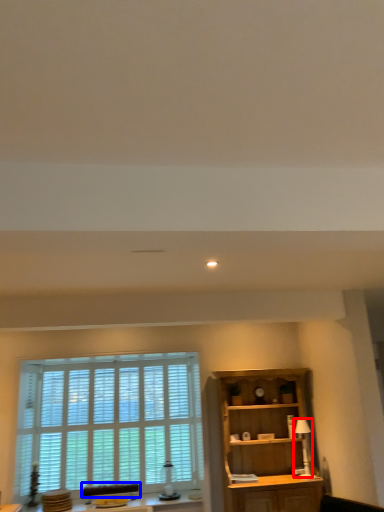
Question: Which point is closer to the camera, lamp (highlighted by a red box) or swivel chair (highlighted by a blue box)?

Choices:
 (A) lamp
 (B) swivel chair

Answer: (A)